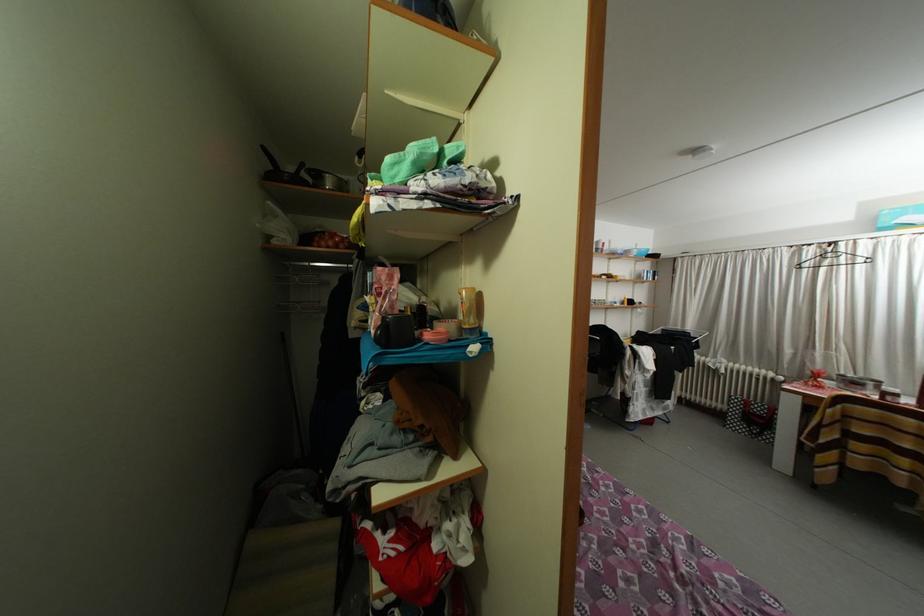
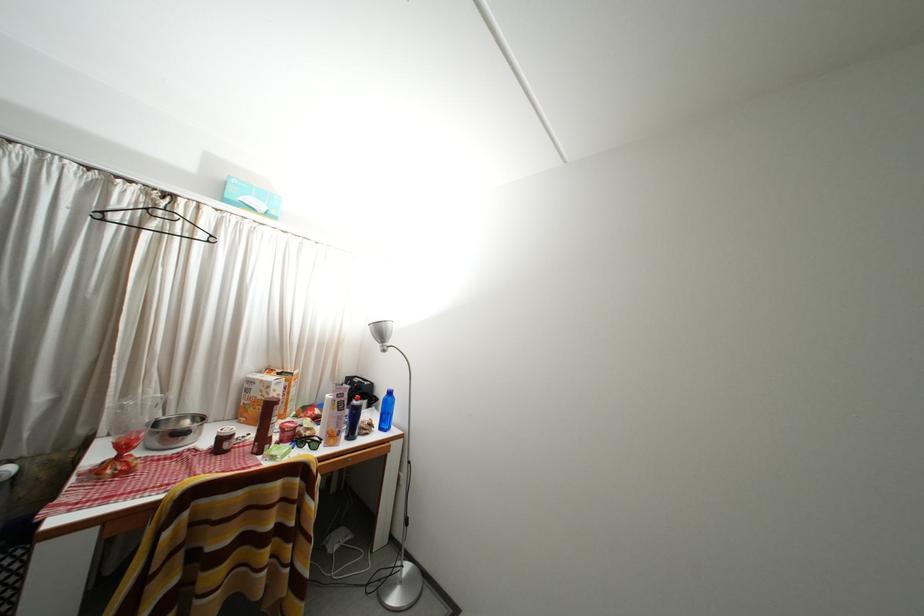
Where in the second image is the point corresponding to pixel 833 268 from the first image?

(161, 230)